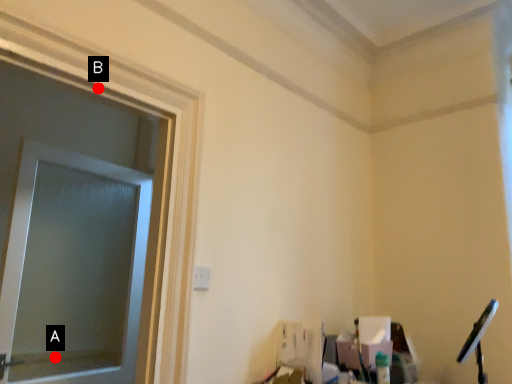
Question: Two points are circled on the image, labeled by A and B beside each circle. Among these points, which one is nearest to the camera?

Choices:
 (A) A is closer
 (B) B is closer

Answer: (B)